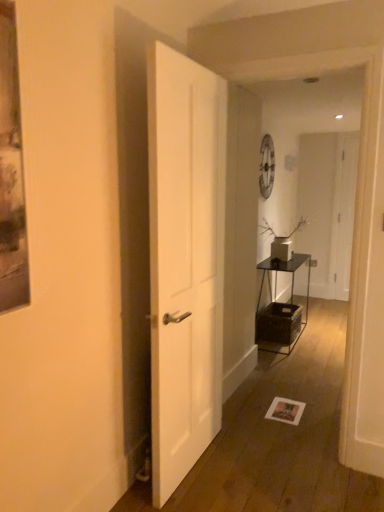
The image size is (384, 512). What are the coordinates of `white matte door at right, the second door viewed from the front` in the screenshot? It's located at point(345,213).

This screenshot has height=512, width=384. What do you see at coordinates (281, 307) in the screenshot?
I see `metallic black table at center-right` at bounding box center [281, 307].

Locate an element on the screen. Image resolution: width=384 pixels, height=512 pixels. white matte door at center, arranged as the 2th door when viewed from the right is located at coordinates click(185, 261).

I want to click on white matte vase at center-right, so click(x=282, y=240).

Which of these two, metallic black table at center-right or white matte door at right, marked as the 1th door in a right-to-left arrangement, is smaller?

With smaller size is white matte door at right, marked as the 1th door in a right-to-left arrangement.

Can you see metallic black table at center-right touching white matte door at right, marked as the 1th door in a right-to-left arrangement?

No, metallic black table at center-right is not next to white matte door at right, marked as the 1th door in a right-to-left arrangement.

From a real-world perspective, is metallic black table at center-right physically above white matte door at right, the second door viewed from the front?

No, from a real-world perspective, metallic black table at center-right is not over white matte door at right, the second door viewed from the front

Which point is more distant from viewer, (267, 331) or (349, 166)?

Point (349, 166)

Is white matte door at center, the 2th door positioned from the back, to the left of white matte door at right, the second door viewed from the front, from the viewer's perspective?

Yes.

In the scene shown: Which point is more forward, (162,260) or (351,151)?

The point (162,260) is in front.

Which object is further away from the camera taking this photo, white matte door at center, the first door in the front-to-back sequence, or white matte door at right, which appears as the 1th door when viewed from the back?

white matte door at right, which appears as the 1th door when viewed from the back, is further from the camera.

From the image's perspective, which is below, white matte door at center, arranged as the 2th door when viewed from the right, or white matte door at right, the second door viewed from the front?

white matte door at center, arranged as the 2th door when viewed from the right, from the image's perspective.

Is metallic black table at center-right a part of white matte door at right, marked as the 1th door in a right-to-left arrangement?

Actually, metallic black table at center-right is outside white matte door at right, marked as the 1th door in a right-to-left arrangement.

Does white matte door at right, marked as the 1th door in a right-to-left arrangement, have a lesser height compared to metallic black table at center-right?

No, white matte door at right, marked as the 1th door in a right-to-left arrangement, is not shorter than metallic black table at center-right.

Are white matte door at right, marked as the 1th door in a right-to-left arrangement, and metallic black table at center-right beside each other?

No, white matte door at right, marked as the 1th door in a right-to-left arrangement, is not beside metallic black table at center-right.

Between metallic black table at center-right and white matte vase at center-right, which one appears on the left side from the viewer's perspective?

From the viewer's perspective, metallic black table at center-right appears more on the left side.

Considering the relative sizes of metallic black table at center-right and white matte vase at center-right in the image provided, is metallic black table at center-right bigger than white matte vase at center-right?

Yes, metallic black table at center-right is bigger than white matte vase at center-right.

Is point (276, 304) positioned after point (282, 241)?

No, (276, 304) is closer to viewer.

In the image, there is a white matte vase at center-right. Where is `table below it (from the image's perspective)`? This screenshot has width=384, height=512. table below it (from the image's perspective) is located at coordinates (281, 307).

Does white matte door at right, which appears as the 1th door when viewed from the back, come behind white matte door at center, the 2th door positioned from the back?

Yes, it is.

Looking at this image, are white matte door at right, which appears as the 1th door when viewed from the back, and white matte door at center, the first door in the front-to-back sequence, far apart?

Yes, white matte door at right, which appears as the 1th door when viewed from the back, is far from white matte door at center, the first door in the front-to-back sequence.

Can you confirm if white matte door at right, which appears as the second door when viewed from the left, is wider than white matte door at center, the 2th door positioned from the back?

Incorrect, the width of white matte door at right, which appears as the second door when viewed from the left, does not surpass that of white matte door at center, the 2th door positioned from the back.

What's the angular difference between white matte door at right, the second door viewed from the front, and white matte door at center, marked as the 1th door in a left-to-right arrangement,'s facing directions?

They differ by 88.8 degrees in their facing directions.

Is white matte door at center, marked as the 1th door in a left-to-right arrangement, at the back of metallic black table at center-right?

No.

From the picture: Considering the relative positions of metallic black table at center-right and white matte door at center, marked as the 1th door in a left-to-right arrangement, in the image provided, is metallic black table at center-right to the left of white matte door at center, marked as the 1th door in a left-to-right arrangement, from the viewer's perspective?

No, metallic black table at center-right is not to the left of white matte door at center, marked as the 1th door in a left-to-right arrangement.

Is metallic black table at center-right shorter than white matte door at center, the 2th door positioned from the back?

Indeed, metallic black table at center-right has a lesser height compared to white matte door at center, the 2th door positioned from the back.

In the scene shown: Is the surface of white matte vase at center-right in direct contact with white matte door at right, which appears as the second door when viewed from the left?

No, white matte vase at center-right is not touching white matte door at right, which appears as the second door when viewed from the left.

Is white matte vase at center-right bigger than white matte door at right, marked as the 1th door in a right-to-left arrangement?

Yes, white matte vase at center-right is bigger than white matte door at right, marked as the 1th door in a right-to-left arrangement.

Which is more to the right, white matte vase at center-right or white matte door at right, marked as the 1th door in a right-to-left arrangement?

From the viewer's perspective, white matte door at right, marked as the 1th door in a right-to-left arrangement, appears more on the right side.

Who is taller, white matte vase at center-right or white matte door at right, which appears as the second door when viewed from the left?

white matte door at right, which appears as the second door when viewed from the left.

The height and width of the screenshot is (512, 384). I want to click on table below the white matte door at right, the second door viewed from the front (from the image's perspective), so click(x=281, y=307).

I want to click on door behind the white matte door at center, marked as the 1th door in a left-to-right arrangement, so click(x=345, y=213).

Looking at the image, which one is located closer to white matte door at center, marked as the 1th door in a left-to-right arrangement, white matte door at right, the second door viewed from the front, or white matte vase at center-right?

white matte vase at center-right lies closer to white matte door at center, marked as the 1th door in a left-to-right arrangement, than the other object.

Considering their positions, is metallic black table at center-right positioned closer to white matte door at right, which appears as the 1th door when viewed from the back, than white matte vase at center-right?

The object closer to white matte door at right, which appears as the 1th door when viewed from the back, is metallic black table at center-right.

Which object lies nearer to the anchor point white matte door at center, arranged as the 2th door when viewed from the right, metallic black table at center-right or white matte vase at center-right?

Among the two, white matte vase at center-right is located nearer to white matte door at center, arranged as the 2th door when viewed from the right.

Estimate the real-world distances between objects in this image. Which object is closer to white matte door at right, which appears as the second door when viewed from the left, white matte door at center, arranged as the 2th door when viewed from the right, or metallic black table at center-right?

metallic black table at center-right.

Which object lies nearer to the anchor point white matte vase at center-right, white matte door at center, the first door in the front-to-back sequence, or metallic black table at center-right?

Based on the image, metallic black table at center-right appears to be nearer to white matte vase at center-right.

Which object lies further to the anchor point white matte vase at center-right, white matte door at right, the second door viewed from the front, or metallic black table at center-right?

Based on the image, white matte door at right, the second door viewed from the front, appears to be further to white matte vase at center-right.

Estimate the real-world distances between objects in this image. Which object is closer to white matte door at right, which appears as the 1th door when viewed from the back, white matte vase at center-right or metallic black table at center-right?

Among the two, metallic black table at center-right is located nearer to white matte door at right, which appears as the 1th door when viewed from the back.

Considering their positions, is white matte vase at center-right positioned closer to metallic black table at center-right than white matte door at center, the first door in the front-to-back sequence?

Based on the image, white matte vase at center-right appears to be nearer to metallic black table at center-right.

Locate an element on the screen. table located between white matte door at center, the first door in the front-to-back sequence, and white matte vase at center-right in the depth direction is located at coordinates (281, 307).

The height and width of the screenshot is (512, 384). Identify the location of table positioned between white matte door at center, arranged as the 2th door when viewed from the right, and white matte door at right, which appears as the second door when viewed from the left, from near to far. (281, 307).

Identify the location of houseplant between metallic black table at center-right and white matte door at right, marked as the 1th door in a right-to-left arrangement, in the front-back direction. (282, 240).

I want to click on houseplant between white matte door at center, the 2th door positioned from the back, and white matte door at right, marked as the 1th door in a right-to-left arrangement, along the z-axis, so click(282, 240).